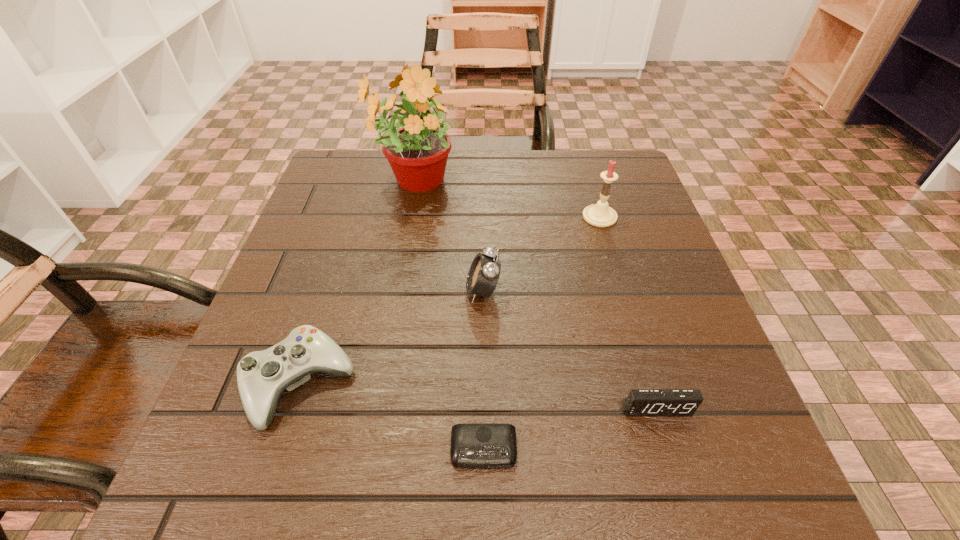
I want to click on candle situated at the right edge, so click(x=600, y=215).

You are a GUI agent. You are given a task and a screenshot of the screen. Output one action in this format:
    pyautogui.click(x=<x>, y=<y>)
    Task: Click on the alarm clock present at the right edge
    
    Given the screenshot: What is the action you would take?
    pyautogui.click(x=640, y=402)

Identify the location of object positioned at the far left corner. Image resolution: width=960 pixels, height=540 pixels. (417, 152).

At what (x,y) coordinates should I click in order to perform the action: click on vacant space at the far edge. Please return your answer as a coordinate pair (x, y). Looking at the image, I should click on 459,154.

Locate an element on the screen. This screenshot has width=960, height=540. blank space at the near edge of the desktop is located at coordinates click(x=488, y=470).

The width and height of the screenshot is (960, 540). In order to click on vacant space at the left edge in this screenshot , I will do `click(365, 210)`.

I want to click on free region at the right edge of the desktop, so click(641, 275).

You are a GUI agent. You are given a task and a screenshot of the screen. Output one action in this format:
    pyautogui.click(x=<x>, y=<y>)
    Task: Click on the free space at the far left corner
    
    Given the screenshot: What is the action you would take?
    pyautogui.click(x=364, y=179)

In the image, there is a desktop. At what (x,y) coordinates should I click in order to perform the action: click on vacant area at the far right corner. Please return your answer as a coordinate pair (x, y). This screenshot has height=540, width=960. Looking at the image, I should click on (x=619, y=176).

At what (x,y) coordinates should I click in order to perform the action: click on vacant space at the near right corner of the desktop. Please return your answer as a coordinate pair (x, y). The height and width of the screenshot is (540, 960). Looking at the image, I should click on (696, 509).